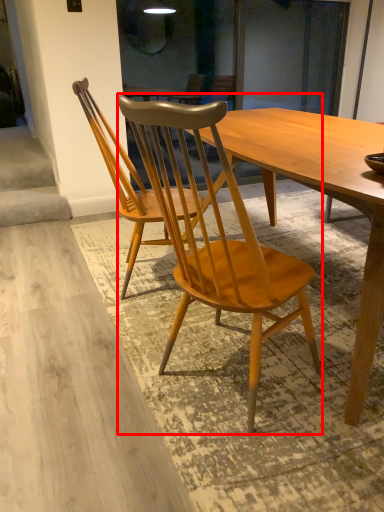
Question: In this image, where is chair (annotated by the red box) located relative to chair?

Choices:
 (A) right
 (B) left

Answer: (A)